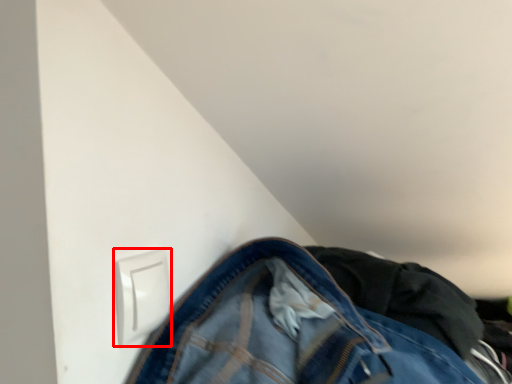
Question: From the image, what is the correct spatial relationship of electric outlet (annotated by the red box) in relation to trousers?

Choices:
 (A) left
 (B) right

Answer: (A)